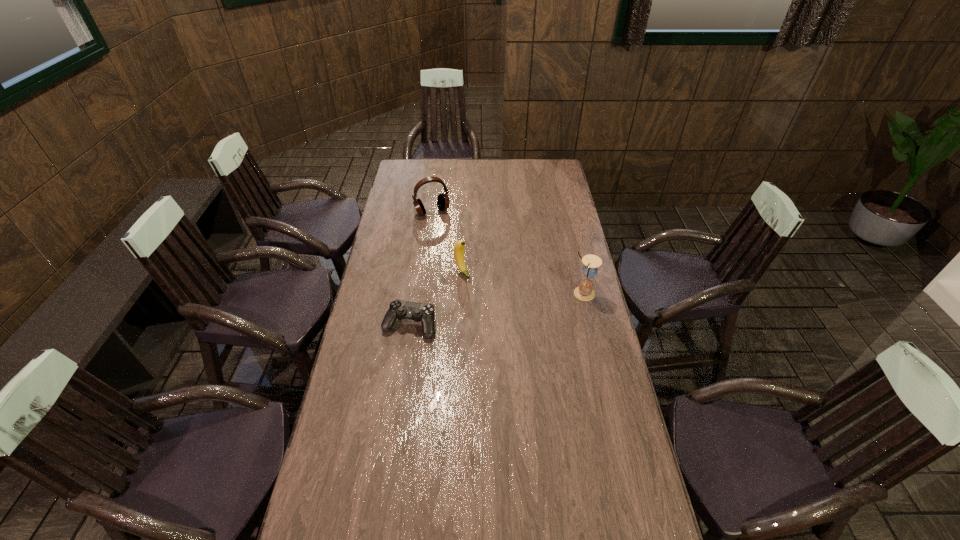
Identify the location of vacant space at the right edge of the desktop. point(551,192).

Image resolution: width=960 pixels, height=540 pixels. Find the location of `free spot between the third object from left to right and the third farthest object`. free spot between the third object from left to right and the third farthest object is located at coordinates (522, 282).

Where is `free point between the farthest object and the hourglass`? free point between the farthest object and the hourglass is located at coordinates (508, 253).

Identify the location of free space between the third farthest object and the nearest object. 496,309.

The image size is (960, 540). I want to click on vacant space that's between the control and the headset, so click(x=420, y=268).

Find the location of `free space between the nearest object and the third farthest object`. free space between the nearest object and the third farthest object is located at coordinates 496,309.

Where is `vacant area that lies between the shortest object and the banana`? vacant area that lies between the shortest object and the banana is located at coordinates (436, 298).

The width and height of the screenshot is (960, 540). What are the coordinates of `vacant area between the third nearest object and the farthest object` in the screenshot? It's located at (447, 241).

In order to click on free space between the farthest object and the hourglass in this screenshot , I will do `click(508, 253)`.

Where is `blank region between the hourglass and the third nearest object`? The width and height of the screenshot is (960, 540). blank region between the hourglass and the third nearest object is located at coordinates (522, 282).